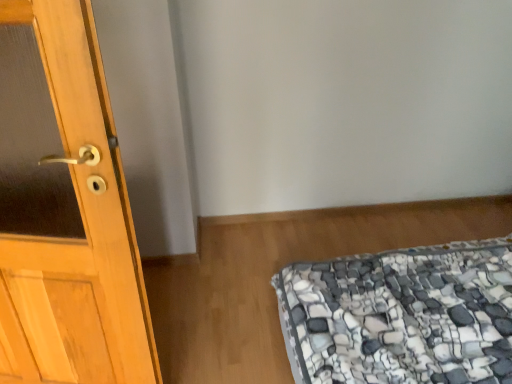
What do you see at coordinates (84, 230) in the screenshot? I see `light wood door at left` at bounding box center [84, 230].

Locate an element on the screen. This screenshot has width=512, height=384. light wood door at left is located at coordinates (84, 230).

At what (x,y) coordinates should I click in order to perform the action: click on stone-patterned fabric at lower right. Please return your answer as a coordinate pair (x, y). Image resolution: width=512 pixels, height=384 pixels. Looking at the image, I should click on (401, 316).

What do you see at coordinates (401, 316) in the screenshot? The height and width of the screenshot is (384, 512). I see `stone-patterned fabric at lower right` at bounding box center [401, 316].

Measure the distance between stone-patterned fabric at lower right and camera.

stone-patterned fabric at lower right is 1.35 meters away from camera.

Find the location of a particular element. Image resolution: width=512 pixels, height=384 pixels. light wood door at left is located at coordinates (84, 230).

Considering the positions of objects stone-patterned fabric at lower right and light wood door at left in the image provided, who is more to the left, stone-patterned fabric at lower right or light wood door at left?

From the viewer's perspective, light wood door at left appears more on the left side.

Which is behind, stone-patterned fabric at lower right or light wood door at left?

stone-patterned fabric at lower right.

Which point is more distant from viewer, (446, 379) or (14, 281)?

Point (446, 379)

From the image's perspective, between stone-patterned fabric at lower right and light wood door at left, which one is located above?

light wood door at left is shown above in the image.

Based on the photo, from a real-world perspective, between stone-patterned fabric at lower right and light wood door at left, who is vertically higher?

light wood door at left, from a real-world perspective.

Does stone-patterned fabric at lower right have a greater width compared to light wood door at left?

Yes, stone-patterned fabric at lower right is wider than light wood door at left.

Considering the relative sizes of stone-patterned fabric at lower right and light wood door at left in the image provided, is stone-patterned fabric at lower right taller than light wood door at left?

No.

Considering the sizes of objects stone-patterned fabric at lower right and light wood door at left in the image provided, who is smaller, stone-patterned fabric at lower right or light wood door at left?

light wood door at left is smaller.

Would you say light wood door at left is part of stone-patterned fabric at lower right's contents?

No, light wood door at left is not a part of stone-patterned fabric at lower right.

Is stone-patterned fabric at lower right far away from light wood door at left?

No, there isn't a large distance between stone-patterned fabric at lower right and light wood door at left.

Is stone-patterned fabric at lower right oriented towards light wood door at left?

Yes, stone-patterned fabric at lower right faces towards light wood door at left.

How different are the orientations of stone-patterned fabric at lower right and light wood door at left in degrees?

They differ by 75.8 degrees in their facing directions.

Identify the location of mattress located below the light wood door at left (from the image's perspective). The width and height of the screenshot is (512, 384). (401, 316).

In the scene shown: Is light wood door at left to the left or to the right of stone-patterned fabric at lower right in the image?

light wood door at left is to the left of stone-patterned fabric at lower right.

Which object is more forward, light wood door at left or stone-patterned fabric at lower right?

light wood door at left is in front.

Which is behind, point (72, 69) or point (317, 312)?

The point (317, 312) is farther from the camera.

From the image's perspective, which object appears higher, light wood door at left or stone-patterned fabric at lower right?

light wood door at left.

From a real-world perspective, is light wood door at left positioned over stone-patterned fabric at lower right based on gravity?

Yes.

Does light wood door at left have a lesser width compared to stone-patterned fabric at lower right?

Yes.

In terms of height, does light wood door at left look taller or shorter compared to stone-patterned fabric at lower right?

Clearly, light wood door at left is taller compared to stone-patterned fabric at lower right.

Considering the sizes of objects light wood door at left and stone-patterned fabric at lower right in the image provided, who is bigger, light wood door at left or stone-patterned fabric at lower right?

With larger size is stone-patterned fabric at lower right.

Is light wood door at left situated inside stone-patterned fabric at lower right or outside?

light wood door at left is not enclosed by stone-patterned fabric at lower right.

Is light wood door at left with stone-patterned fabric at lower right?

No, light wood door at left is not beside stone-patterned fabric at lower right.

Is light wood door at left facing towards stone-patterned fabric at lower right?

No, light wood door at left is not facing towards stone-patterned fabric at lower right.

Where is `mattress below the light wood door at left (from the image's perspective)`? This screenshot has width=512, height=384. mattress below the light wood door at left (from the image's perspective) is located at coordinates (401, 316).

This screenshot has width=512, height=384. I want to click on mattress behind the light wood door at left, so click(x=401, y=316).

Image resolution: width=512 pixels, height=384 pixels. I want to click on mattress to the right of light wood door at left, so click(x=401, y=316).